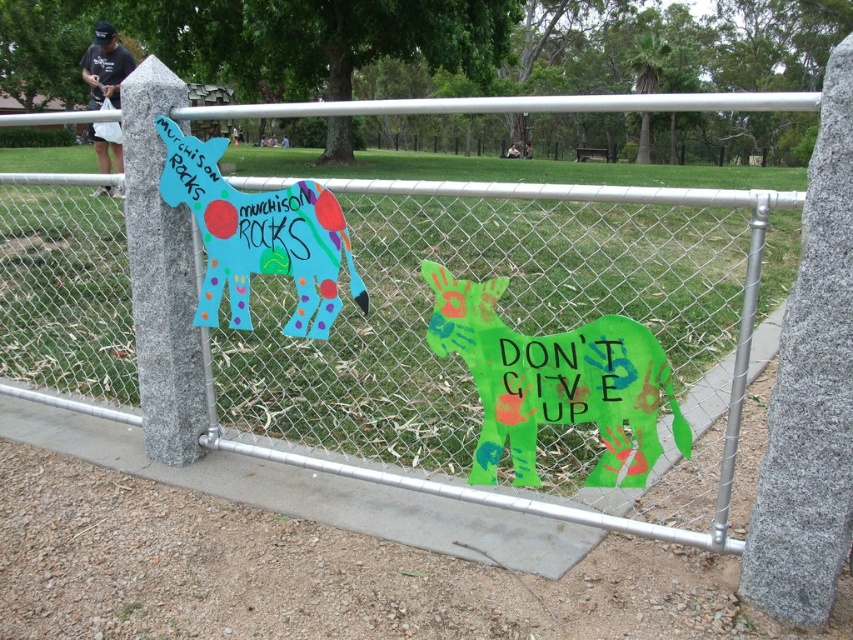
Does metal chain-link fence at center appear under matte painted donkey at center left?

Incorrect, metal chain-link fence at center is not positioned below matte painted donkey at center left.

Between metal chain-link fence at center and matte painted donkey at center left, which one is positioned lower?

matte painted donkey at center left is lower down.

What do you see at coordinates (515, 496) in the screenshot? I see `metal chain-link fence at center` at bounding box center [515, 496].

In order to click on metal chain-link fence at center in this screenshot , I will do `click(515, 496)`.

Between point (515, 154) and point (525, 147), which one is positioned behind?

The point (525, 147) is more distant.

Is white fabric bag at upper center smaller than brushed metal water at bottle left?

Actually, white fabric bag at upper center might be larger than brushed metal water at bottle left.

Measure the distance between white fabric bag at upper center and camera.

24.81 meters

Locate an element on the screen. The height and width of the screenshot is (640, 853). white fabric bag at upper center is located at coordinates click(514, 150).

Does point (157, 380) come in front of point (115, 83)?

Yes.

Is granite signpost at left wider than black cotton shirt at upper left?

No, granite signpost at left is not wider than black cotton shirt at upper left.

Between point (155, 227) and point (96, 157), which one is positioned in front?

Point (155, 227) is in front.

Identify the location of granite signpost at left. (161, 276).